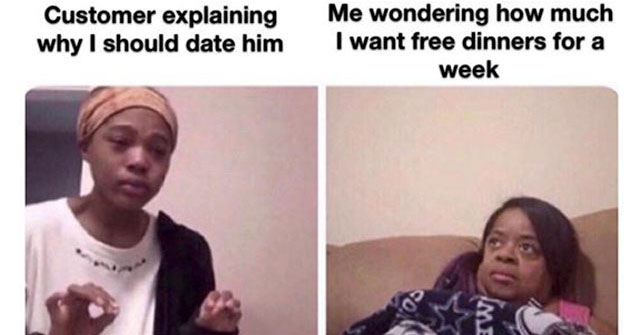
The width and height of the screenshot is (640, 335). Identify the location of wall. (445, 124), (252, 171).